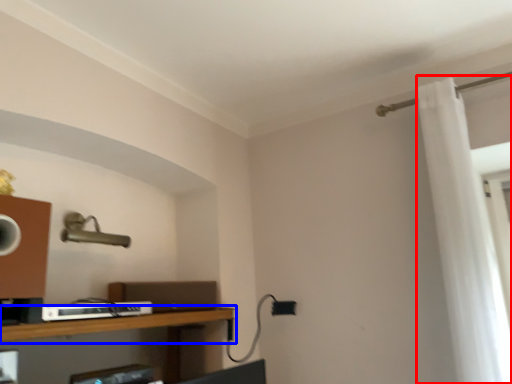
Question: Which object appears closest to the camera in this image, shower curtain (highlighted by a red box) or shelf (highlighted by a blue box)?

Choices:
 (A) shower curtain
 (B) shelf

Answer: (B)